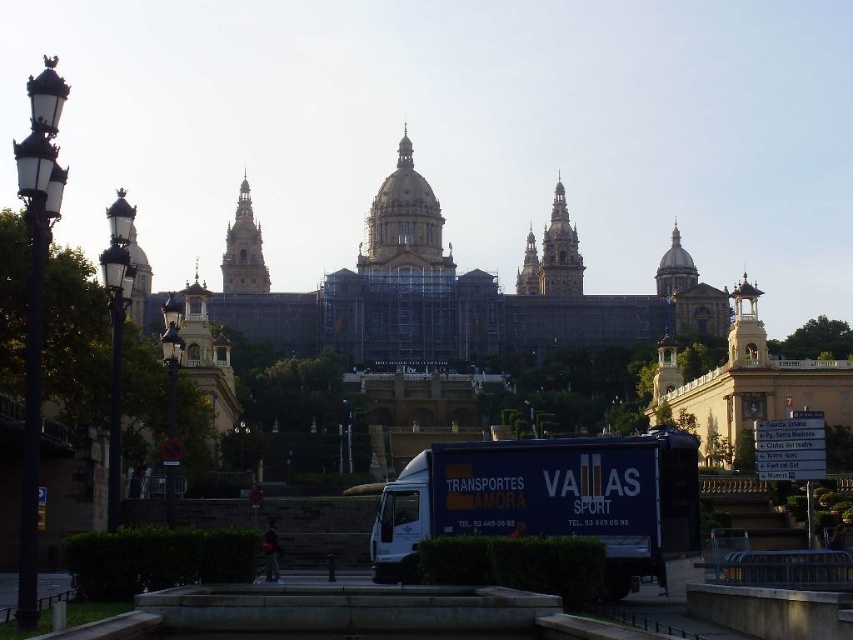
Question: Which object appears closest to the camera in this image?

Choices:
 (A) golden stone palace at center
 (B) blue matte truck at center

Answer: (B)

Question: Can you confirm if golden stone palace at center is bigger than blue matte truck at center?

Choices:
 (A) yes
 (B) no

Answer: (A)

Question: Does golden stone palace at center come in front of blue matte truck at center?

Choices:
 (A) no
 (B) yes

Answer: (A)

Question: Which object is closer to the camera taking this photo?

Choices:
 (A) golden stone palace at center
 (B) blue matte truck at center

Answer: (B)

Question: Is golden stone palace at center in front of blue matte truck at center?

Choices:
 (A) yes
 (B) no

Answer: (B)

Question: Which point is farther to the camera?

Choices:
 (A) (637, 483)
 (B) (132, 285)

Answer: (B)